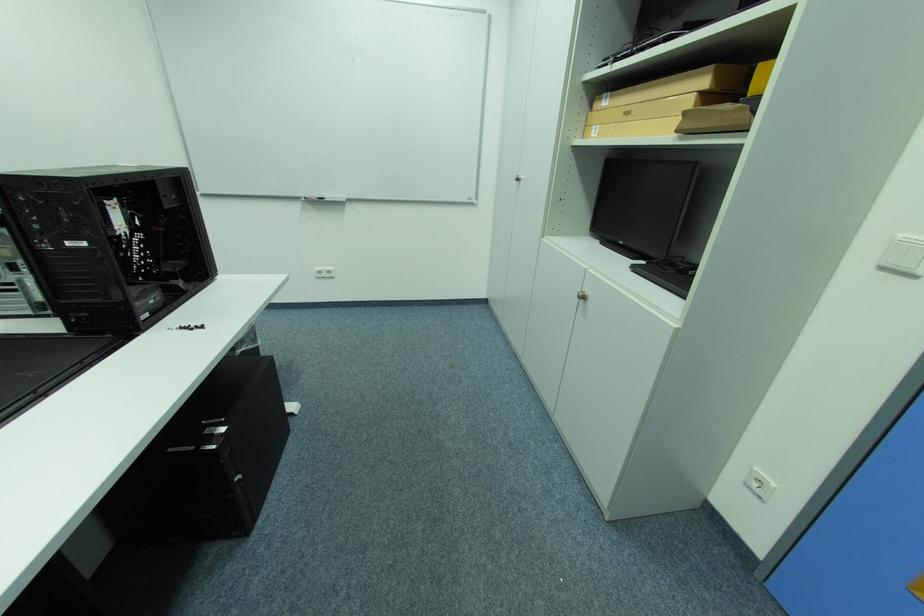
The height and width of the screenshot is (616, 924). What are the coordinates of `white light switch` in the screenshot? It's located at (907, 254).